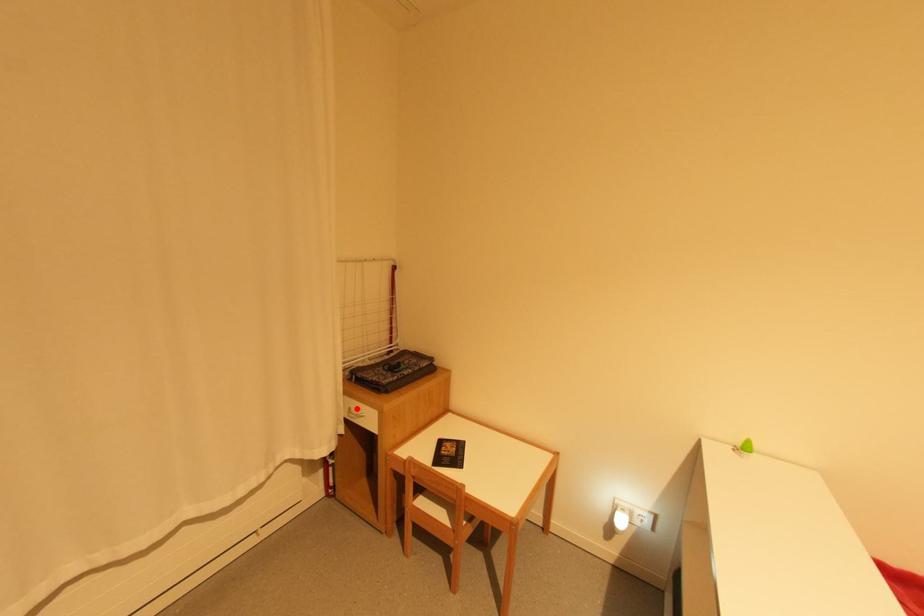
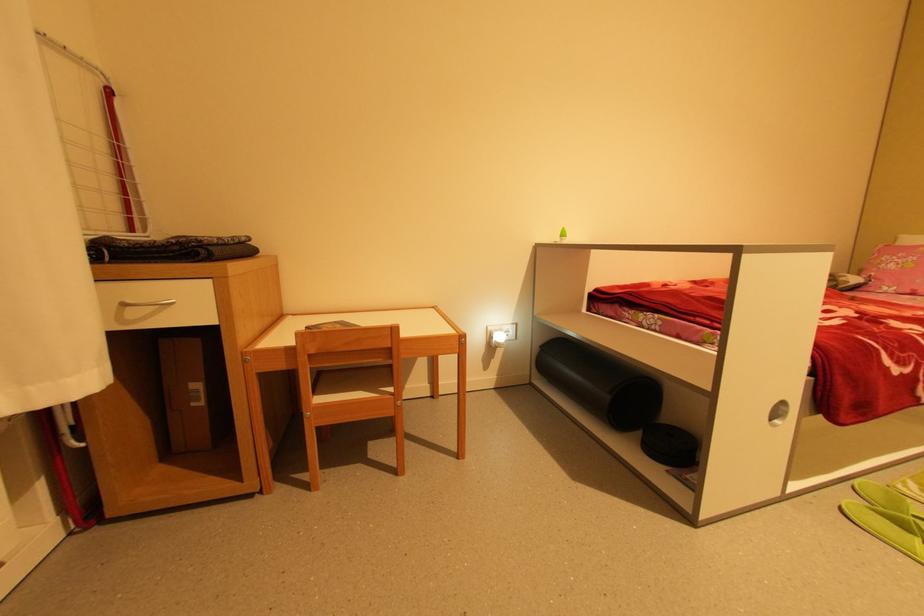
In the second image, find the point that corresponds to the highlighted location in the first image.

(134, 302)